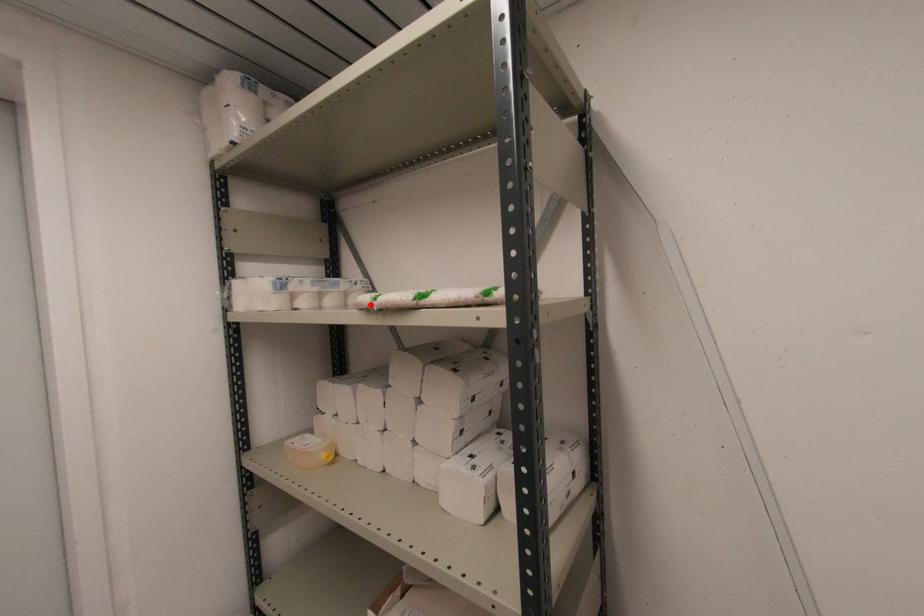
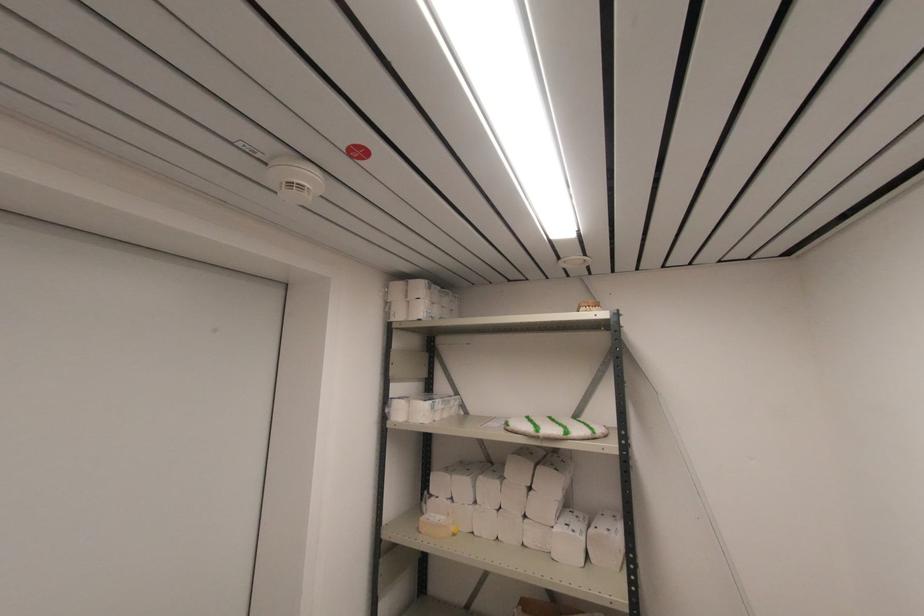
Find the pixel in the second image that matches the highlighted location in the first image.

(537, 436)